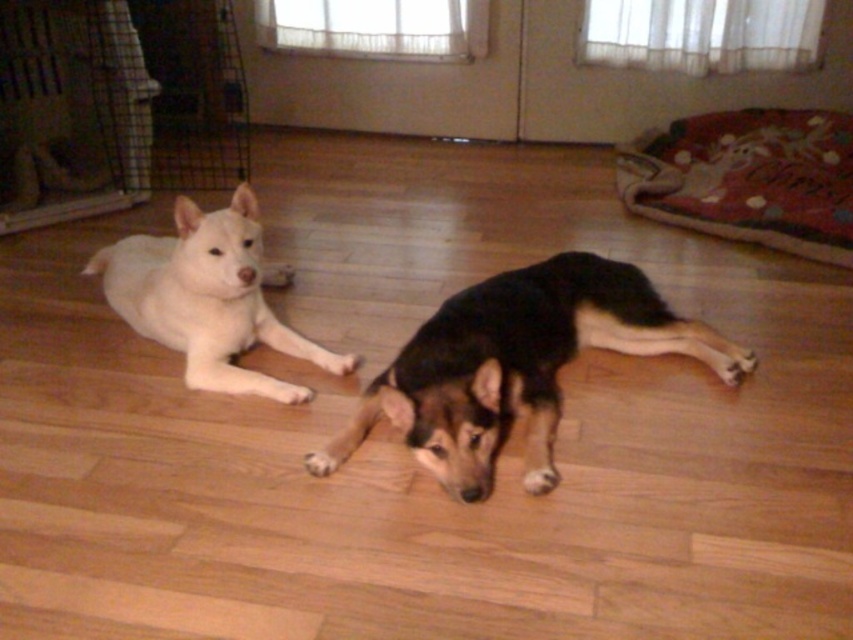
Which is behind, point (448, 396) or point (94, 260)?

Point (94, 260)

Which is more to the right, black fur dog at center or white fur dog at left?

Positioned to the right is black fur dog at center.

The height and width of the screenshot is (640, 853). What do you see at coordinates (515, 365) in the screenshot? I see `black fur dog at center` at bounding box center [515, 365].

At what (x,y) coordinates should I click in order to perform the action: click on black fur dog at center. Please return your answer as a coordinate pair (x, y). The height and width of the screenshot is (640, 853). Looking at the image, I should click on click(x=515, y=365).